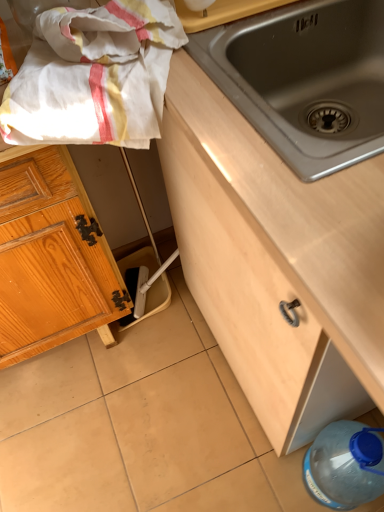
Question: Is blue translucent bottle at lower right at the back of stainless steel sink at center?

Choices:
 (A) no
 (B) yes

Answer: (A)

Question: Is stainless steel sink at center oriented towards blue translucent bottle at lower right?

Choices:
 (A) yes
 (B) no

Answer: (B)

Question: Is stainless steel sink at center located outside blue translucent bottle at lower right?

Choices:
 (A) no
 (B) yes

Answer: (B)

Question: Can you confirm if stainless steel sink at center is shorter than blue translucent bottle at lower right?

Choices:
 (A) no
 (B) yes

Answer: (B)

Question: From a real-world perspective, is stainless steel sink at center physically below blue translucent bottle at lower right?

Choices:
 (A) yes
 (B) no

Answer: (B)

Question: In terms of width, does white cotton towel at upper left look wider or thinner when compared to wooden cabinet at left, the 1th cabinetry in the left-to-right sequence?

Choices:
 (A) thin
 (B) wide

Answer: (A)

Question: From the image's perspective, relative to wooden cabinet at left, the second cabinetry from the right, is white cotton towel at upper left above or below?

Choices:
 (A) above
 (B) below

Answer: (A)

Question: In terms of height, does white cotton towel at upper left look taller or shorter compared to wooden cabinet at left, the second cabinetry from the right?

Choices:
 (A) short
 (B) tall

Answer: (A)

Question: Looking at the image, does white cotton towel at upper left seem bigger or smaller compared to wooden cabinet at left, the 1th cabinetry in the left-to-right sequence?

Choices:
 (A) big
 (B) small

Answer: (B)

Question: From a real-world perspective, is white cotton towel at upper left physically located above or below wooden cabinet at center, which is counted as the 2th cabinetry, starting from the left?

Choices:
 (A) below
 (B) above

Answer: (B)

Question: Does point (147, 100) appear closer or farther from the camera than point (213, 284)?

Choices:
 (A) farther
 (B) closer

Answer: (B)

Question: From the image's perspective, is white cotton towel at upper left above or below wooden cabinet at center, which is counted as the first cabinetry, starting from the right?

Choices:
 (A) above
 (B) below

Answer: (A)

Question: Visually, is white cotton towel at upper left positioned to the left or to the right of wooden cabinet at center, which is counted as the first cabinetry, starting from the right?

Choices:
 (A) right
 (B) left

Answer: (B)

Question: Considering the positions of point (269, 16) and point (367, 453), is point (269, 16) closer or farther from the camera than point (367, 453)?

Choices:
 (A) farther
 (B) closer

Answer: (B)

Question: From the image's perspective, is stainless steel sink at center positioned above or below blue translucent bottle at lower right?

Choices:
 (A) below
 (B) above

Answer: (B)